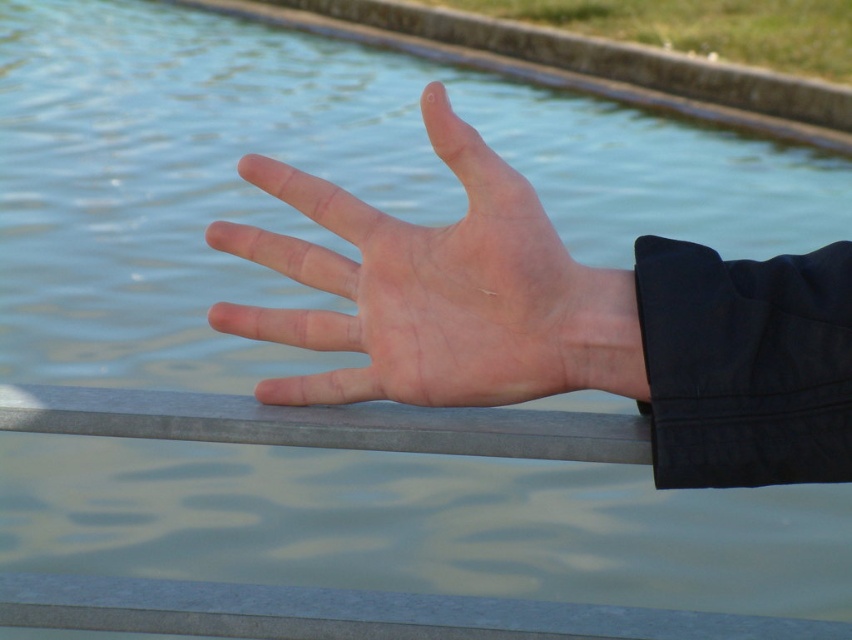
Between skinny hand at center and pale skin hand at center, which one has less height?

With less height is pale skin hand at center.

Is skinny hand at center below pale skin hand at center?

Indeed, skinny hand at center is positioned under pale skin hand at center.

At what (x,y) coordinates should I click in order to perform the action: click on skinny hand at center. Please return your answer as a coordinate pair (x, y). This screenshot has width=852, height=640. Looking at the image, I should click on (562, 321).